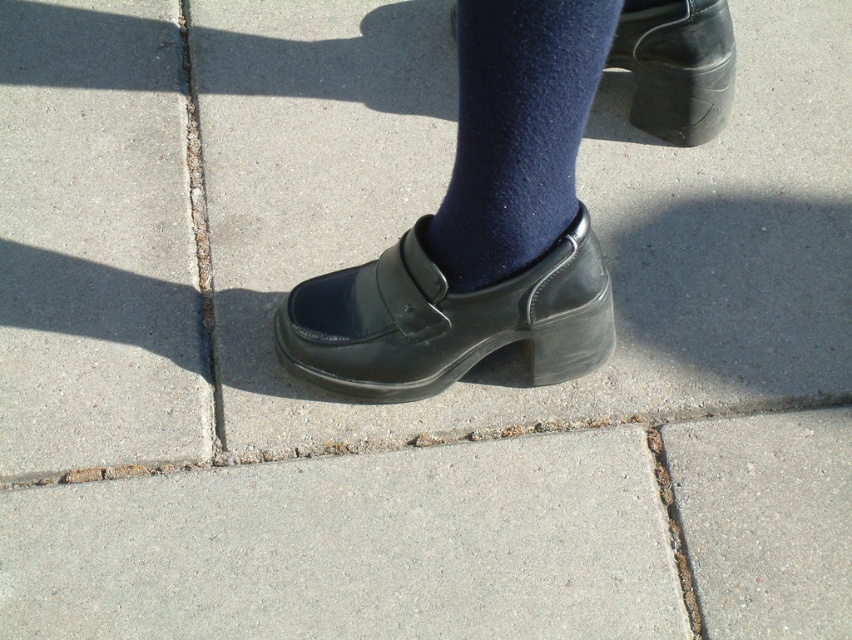
You are standing at the point marked by the coordinates point (446,320). Looking around, you see a paved area with rectangular concrete tiles. What object is exactly at your current position?

The point (446,320) marks the location of the black leather shoe at center, so the object exactly at your current position is the black leather shoe at center.